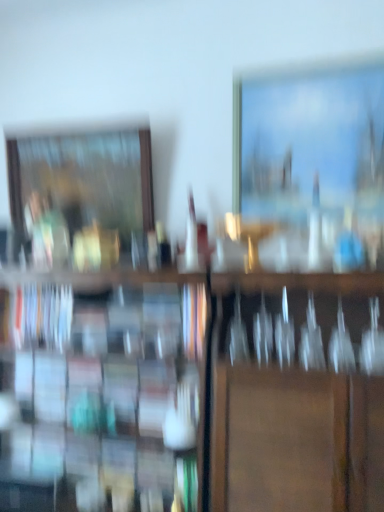
Describe the element at coordinates (80, 192) in the screenshot. The height and width of the screenshot is (512, 384). I see `wooden picture frame at left, the 2th picture frame viewed from the front` at that location.

The image size is (384, 512). Find the location of `matte wooden picture frame at upper right, the 1th picture frame from the right`. matte wooden picture frame at upper right, the 1th picture frame from the right is located at coordinates (312, 164).

From a real-world perspective, is hardcover book at left over matte wooden picture frame at upper right, marked as the 2th picture frame in a left-to-right arrangement?

No, from a real-world perspective, hardcover book at left is not over matte wooden picture frame at upper right, marked as the 2th picture frame in a left-to-right arrangement

Based on the photo, measure the distance between hardcover book at left and matte wooden picture frame at upper right, the 1th picture frame from the right.

A distance of 87.63 centimeters exists between hardcover book at left and matte wooden picture frame at upper right, the 1th picture frame from the right.

Is hardcover book at left further to camera compared to matte wooden picture frame at upper right, acting as the 1th picture frame starting from the front?

Yes.

Is point (39, 293) farther from camera compared to point (349, 101)?

Yes, point (39, 293) is farther from viewer.

Who is bigger, matte wooden picture frame at upper right, which is the 2th picture frame in back-to-front order, or hardcover book at left?

hardcover book at left.

Between matte wooden picture frame at upper right, which is the 2th picture frame in back-to-front order, and hardcover book at left, which one appears on the right side from the viewer's perspective?

Positioned to the right is matte wooden picture frame at upper right, which is the 2th picture frame in back-to-front order.

Consider the image. Considering their positions, is matte wooden picture frame at upper right, acting as the 1th picture frame starting from the front, located in front of or behind hardcover book at left?

matte wooden picture frame at upper right, acting as the 1th picture frame starting from the front, is positioned closer to the viewer than hardcover book at left.

Is wooden bookshelf at center thinner than hardcover book at left?

In fact, wooden bookshelf at center might be wider than hardcover book at left.

Is point (241, 362) farther from viewer compared to point (58, 306)?

No, it is not.

Is the surface of wooden bookshelf at center in direct contact with hardcover book at left?

No, wooden bookshelf at center is not making contact with hardcover book at left.

Is wooden bookshelf at center positioned before hardcover book at left?

Yes.

Which is more to the right, hardcover book at left or wooden bookshelf at center?

wooden bookshelf at center is more to the right.

Considering the positions of objects hardcover book at left and wooden bookshelf at center in the image provided, who is behind, hardcover book at left or wooden bookshelf at center?

hardcover book at left is more distant.

From the image's perspective, which is above, hardcover book at left or wooden bookshelf at center?

hardcover book at left appears higher in the image.

Is wooden bookshelf at center in front of or behind matte wooden picture frame at upper right, the 1th picture frame from the right, in the image?

In the image, wooden bookshelf at center appears in front of matte wooden picture frame at upper right, the 1th picture frame from the right.

Where is `shelf located in front of the matte wooden picture frame at upper right, marked as the 2th picture frame in a left-to-right arrangement`? The height and width of the screenshot is (512, 384). shelf located in front of the matte wooden picture frame at upper right, marked as the 2th picture frame in a left-to-right arrangement is located at coordinates (194, 392).

Would you say matte wooden picture frame at upper right, acting as the 1th picture frame starting from the front, is part of wooden bookshelf at center's contents?

No, matte wooden picture frame at upper right, acting as the 1th picture frame starting from the front, is located outside of wooden bookshelf at center.

Is matte wooden picture frame at upper right, marked as the 2th picture frame in a left-to-right arrangement, positioned in front of wooden picture frame at left, the 2th picture frame viewed from the front?

Yes, matte wooden picture frame at upper right, marked as the 2th picture frame in a left-to-right arrangement, is closer to the viewer.

From the image's perspective, which one is positioned lower, matte wooden picture frame at upper right, which is the 2th picture frame in back-to-front order, or wooden picture frame at left, the 2th picture frame viewed from the front?

wooden picture frame at left, the 2th picture frame viewed from the front, is shown below in the image.

Is matte wooden picture frame at upper right, which is the 2th picture frame in back-to-front order, far away from wooden picture frame at left, arranged as the first picture frame when viewed from the back?

Actually, matte wooden picture frame at upper right, which is the 2th picture frame in back-to-front order, and wooden picture frame at left, arranged as the first picture frame when viewed from the back, are a little close together.

Based on the photo, in terms of width, does matte wooden picture frame at upper right, the 1th picture frame from the right, look wider or thinner when compared to wooden picture frame at left, the 2th picture frame viewed from the front?

Clearly, matte wooden picture frame at upper right, the 1th picture frame from the right, has less width compared to wooden picture frame at left, the 2th picture frame viewed from the front.

In the scene shown: Are hardcover book at left and wooden picture frame at left, arranged as the first picture frame when viewed from the back, far apart?

No, there isn't a large distance between hardcover book at left and wooden picture frame at left, arranged as the first picture frame when viewed from the back.

From the image's perspective, is hardcover book at left located above or below wooden picture frame at left, arranged as the first picture frame when viewed from the back?

hardcover book at left is situated lower than wooden picture frame at left, arranged as the first picture frame when viewed from the back, in the image.

In the scene shown: Which is closer to the camera, (37,305) or (19,153)?

The point (37,305) is closer.

In the scene shown: Considering the relative sizes of hardcover book at left and wooden picture frame at left, arranged as the first picture frame when viewed from the back, in the image provided, is hardcover book at left thinner than wooden picture frame at left, arranged as the first picture frame when viewed from the back,?

Incorrect, the width of hardcover book at left is not less than that of wooden picture frame at left, arranged as the first picture frame when viewed from the back.

Find the location of a particular element. The width and height of the screenshot is (384, 512). book that is below the matte wooden picture frame at upper right, marked as the 2th picture frame in a left-to-right arrangement (from the image's perspective) is located at coordinates (40, 316).

I want to click on picture frame in front of the hardcover book at left, so (x=312, y=164).

Looking at the image, which one is located closer to matte wooden picture frame at upper right, which is the 2th picture frame in back-to-front order, hardcover book at left or wooden picture frame at left, arranged as the first picture frame when viewed from the back?

wooden picture frame at left, arranged as the first picture frame when viewed from the back, is closer to matte wooden picture frame at upper right, which is the 2th picture frame in back-to-front order.

When comparing their distances from wooden picture frame at left, the 2th picture frame viewed from the front, does wooden bookshelf at center or matte wooden picture frame at upper right, acting as the 1th picture frame starting from the front, seem further?

Based on the image, matte wooden picture frame at upper right, acting as the 1th picture frame starting from the front, appears to be further to wooden picture frame at left, the 2th picture frame viewed from the front.

Considering their positions, is wooden picture frame at left, the 2th picture frame from the right, positioned further to matte wooden picture frame at upper right, the 1th picture frame from the right, than hardcover book at left?

Based on the image, hardcover book at left appears to be further to matte wooden picture frame at upper right, the 1th picture frame from the right.

Consider the image. Looking at the image, which one is located further to matte wooden picture frame at upper right, acting as the 1th picture frame starting from the front, wooden bookshelf at center or wooden picture frame at left, the 1th picture frame in the left-to-right sequence?

wooden picture frame at left, the 1th picture frame in the left-to-right sequence.

Based on their spatial positions, is wooden picture frame at left, the 2th picture frame from the right, or matte wooden picture frame at upper right, acting as the 1th picture frame starting from the front, further from wooden bookshelf at center?

matte wooden picture frame at upper right, acting as the 1th picture frame starting from the front, lies further to wooden bookshelf at center than the other object.

Looking at the image, which one is located further to wooden picture frame at left, the 1th picture frame in the left-to-right sequence, hardcover book at left or matte wooden picture frame at upper right, acting as the 1th picture frame starting from the front?

Among the two, matte wooden picture frame at upper right, acting as the 1th picture frame starting from the front, is located further to wooden picture frame at left, the 1th picture frame in the left-to-right sequence.

Considering their positions, is wooden bookshelf at center positioned further to wooden picture frame at left, the 2th picture frame from the right, than hardcover book at left?

Among the two, wooden bookshelf at center is located further to wooden picture frame at left, the 2th picture frame from the right.

When comparing their distances from wooden bookshelf at center, does matte wooden picture frame at upper right, marked as the 2th picture frame in a left-to-right arrangement, or wooden picture frame at left, arranged as the first picture frame when viewed from the back, seem further?

Based on the image, matte wooden picture frame at upper right, marked as the 2th picture frame in a left-to-right arrangement, appears to be further to wooden bookshelf at center.

You are a GUI agent. You are given a task and a screenshot of the screen. Output one action in this format:
    pyautogui.click(x=<x>, y=<y>)
    Task: Click on the picture frame between matte wooden picture frame at upper right, acting as the 1th picture frame starting from the front, and wooden bookshelf at center vertically
    This screenshot has width=384, height=512.
    Given the screenshot: What is the action you would take?
    pyautogui.click(x=80, y=192)

Find the location of a particular element. Image resolution: width=384 pixels, height=512 pixels. book between wooden picture frame at left, the 1th picture frame in the left-to-right sequence, and wooden bookshelf at center in the up-down direction is located at coordinates coord(40,316).

Locate an element on the screen. This screenshot has height=512, width=384. picture frame located between hardcover book at left and matte wooden picture frame at upper right, marked as the 2th picture frame in a left-to-right arrangement, in the left-right direction is located at coordinates (80, 192).

At what (x,y) coordinates should I click in order to perform the action: click on shelf situated between hardcover book at left and matte wooden picture frame at upper right, the 1th picture frame from the right, from left to right. Please return your answer as a coordinate pair (x, y). The height and width of the screenshot is (512, 384). Looking at the image, I should click on (x=194, y=392).